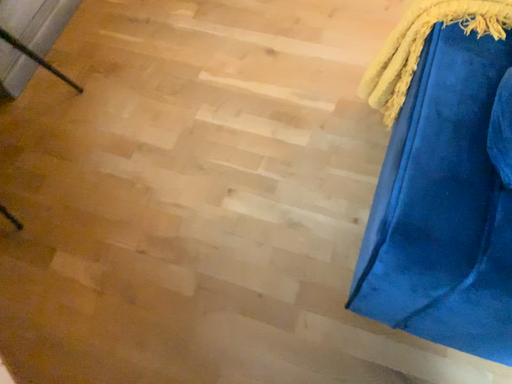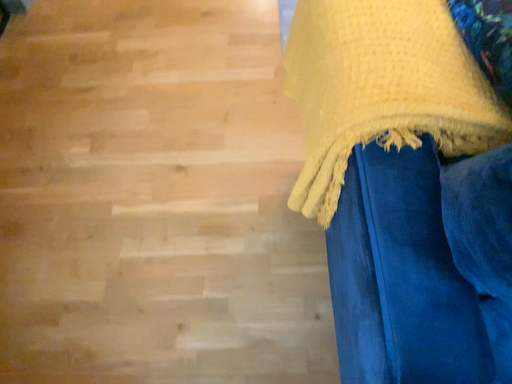
Question: Which way did the camera rotate in the video?

Choices:
 (A) rotated left
 (B) rotated right

Answer: (B)